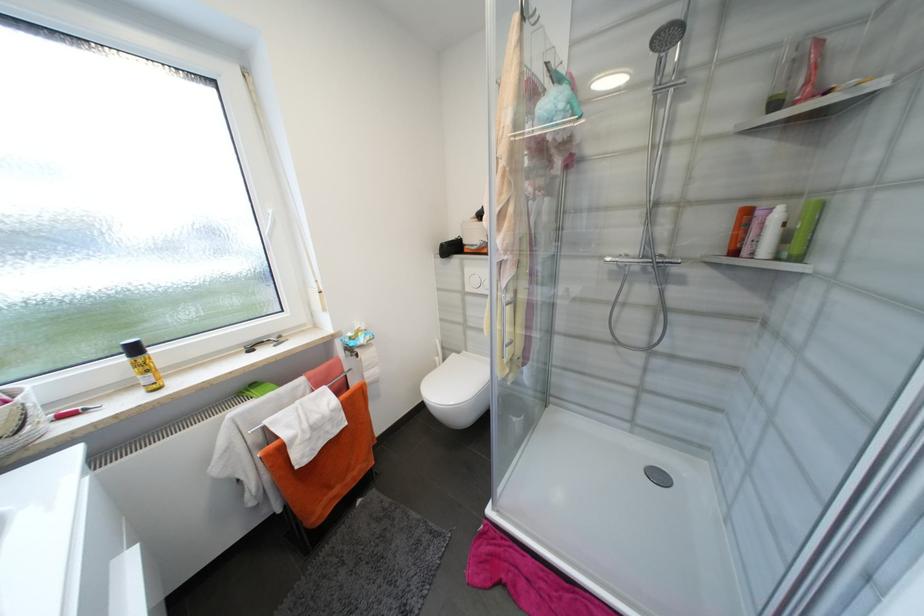
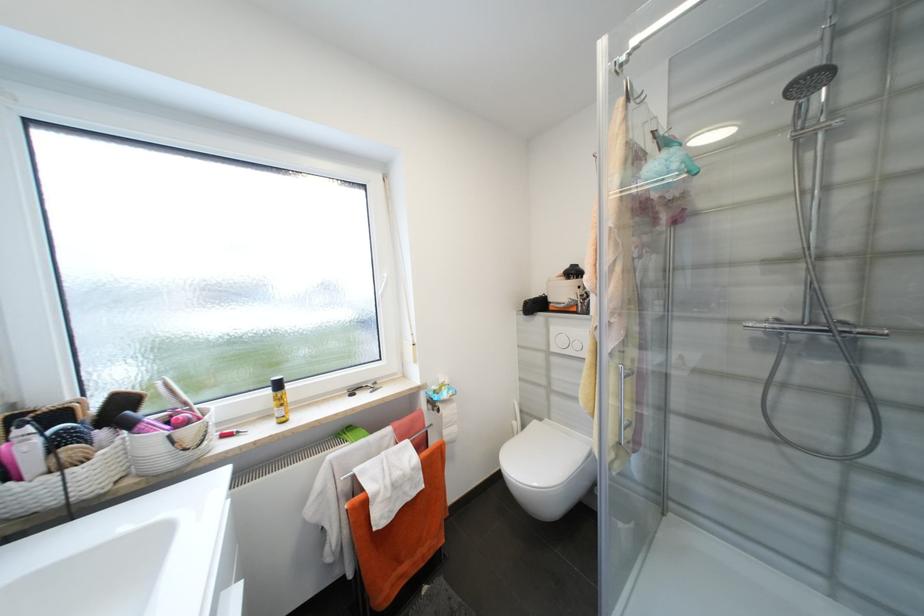
Find the pixel in the second image that matches point 362,357 in the first image.

(444, 411)